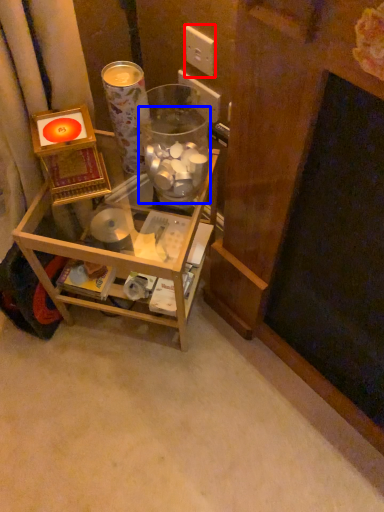
Question: Which of the following is the closest to the observer, electric outlet (highlighted by a red box) or glass jar (highlighted by a blue box)?

Choices:
 (A) electric outlet
 (B) glass jar

Answer: (B)